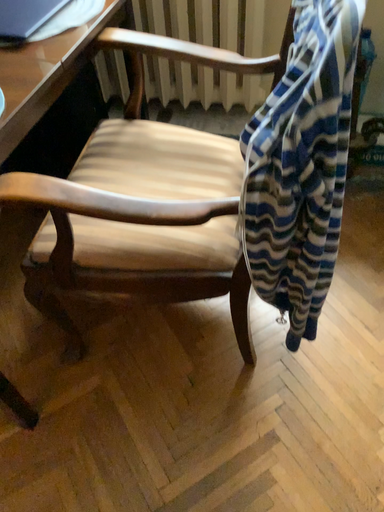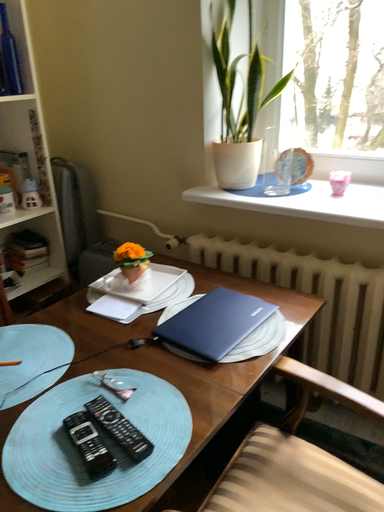
Question: How did the camera likely rotate when shooting the video?

Choices:
 (A) rotated right
 (B) rotated left

Answer: (B)